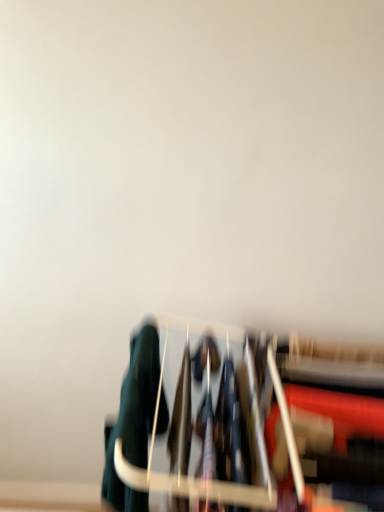
Question: Is metallic silver rack at center situated inside dark green fabric at lower left or outside?

Choices:
 (A) inside
 (B) outside

Answer: (B)

Question: From the image's perspective, is metallic silver rack at center above or below dark green fabric at lower left?

Choices:
 (A) below
 (B) above

Answer: (A)

Question: From their relative heights in the image, would you say metallic silver rack at center is taller or shorter than dark green fabric at lower left?

Choices:
 (A) short
 (B) tall

Answer: (B)

Question: Is dark green fabric at lower left spatially inside metallic silver rack at center, or outside of it?

Choices:
 (A) inside
 (B) outside

Answer: (A)

Question: Considering the positions of dark green fabric at lower left and metallic silver rack at center in the image, is dark green fabric at lower left taller or shorter than metallic silver rack at center?

Choices:
 (A) short
 (B) tall

Answer: (A)

Question: Based on their positions, is dark green fabric at lower left located to the left or right of metallic silver rack at center?

Choices:
 (A) left
 (B) right

Answer: (A)

Question: Considering their positions, is dark green fabric at lower left located in front of or behind metallic silver rack at center?

Choices:
 (A) front
 (B) behind

Answer: (B)